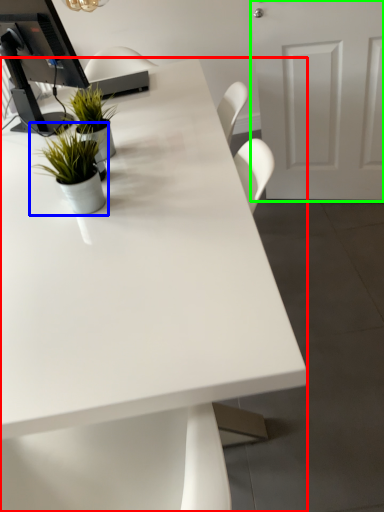
Question: Estimate the real-world distances between objects in this image. Which object is closer to desk (highlighted by a red box), houseplant (highlighted by a blue box) or door (highlighted by a green box)?

Choices:
 (A) houseplant
 (B) door

Answer: (A)